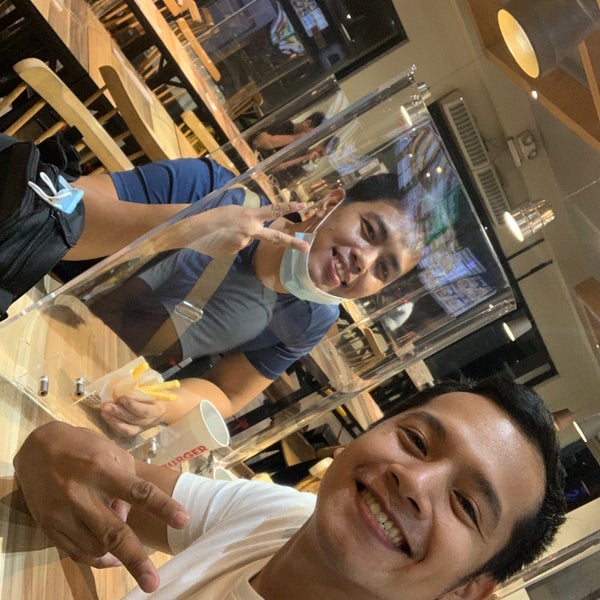
Find the location of `light`. light is located at coordinates (510, 42).